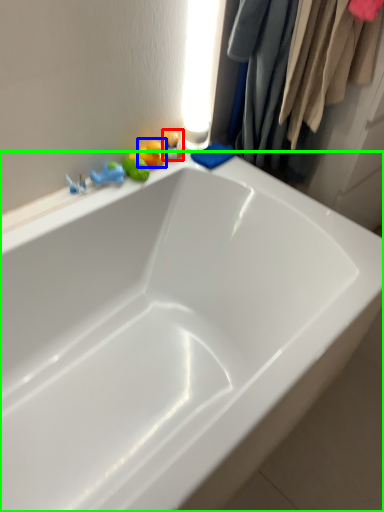
Question: Considering the real-world distances, which object is closest to toy (highlighted by a red box)? toy (highlighted by a blue box) or bathtub (highlighted by a green box).

Choices:
 (A) toy
 (B) bathtub

Answer: (A)